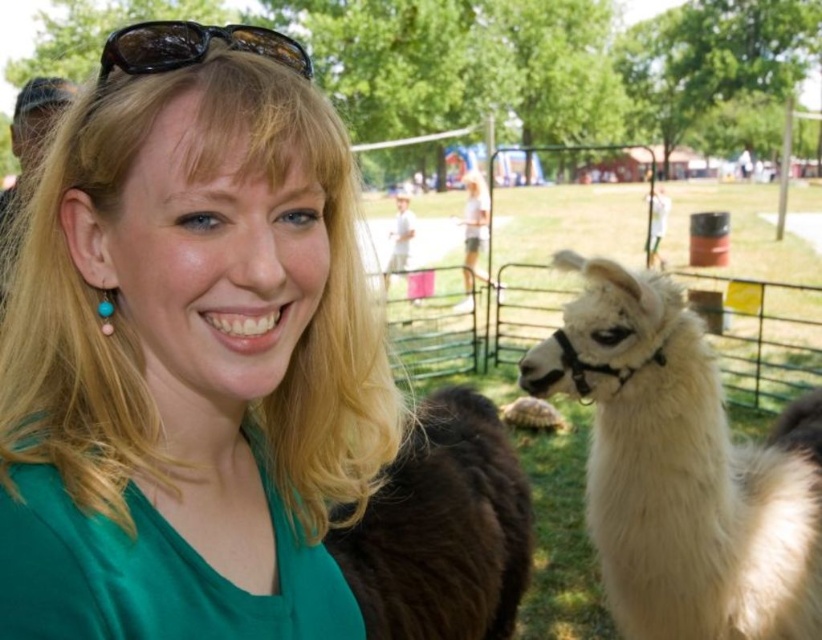
You are a photographer trying to capture a photo of the white fluffy alpaca at right and the brown fuzzy alpaca at right. Which one should you focus on first if you want to include both in your shot without moving the camera?

You should focus on the brown fuzzy alpaca at right first because it is closer to the left side compared to the white fluffy alpaca at right, allowing both to be captured in the frame without moving the camera.

You are a photographer trying to capture a photo of the brown fuzzy alpaca at right and the black shiny sunglasses at upper center. Which object is located higher in the image?

The black shiny sunglasses at upper center are higher than the brown fuzzy alpaca at right because the brown fuzzy alpaca at right is positioned under the black shiny sunglasses at upper center.

You are a photographer trying to capture a photo that includes both the brown fuzzy alpaca at right and the black shiny sunglasses at upper center. Given that your camera has a maximum focus range of 1.5 meters, will you be able to fit both subjects into the frame without moving your position?

The brown fuzzy alpaca at right and the black shiny sunglasses at upper center are 1.74 meters apart from each other. Since the distance between them exceeds the camera maximum focus range of 1.5 meters, you won